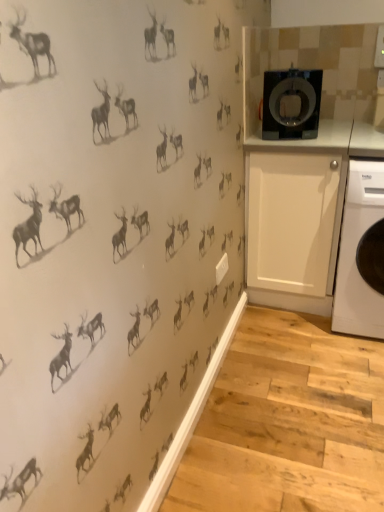
Question: Considering the positions of black glossy washing machine at upper right and white plastic washing machine at right in the image, is black glossy washing machine at upper right taller or shorter than white plastic washing machine at right?

Choices:
 (A) short
 (B) tall

Answer: (A)

Question: From a real-world perspective, is black glossy washing machine at upper right positioned above or below white plastic washing machine at right?

Choices:
 (A) below
 (B) above

Answer: (B)

Question: Which is nearer to the white matte cabinet at right?

Choices:
 (A) black glossy washing machine at upper right
 (B) white plastic washing machine at right

Answer: (B)

Question: Which object is the farthest from the white plastic washing machine at right?

Choices:
 (A) black glossy washing machine at upper right
 (B) white matte cabinet at right

Answer: (A)